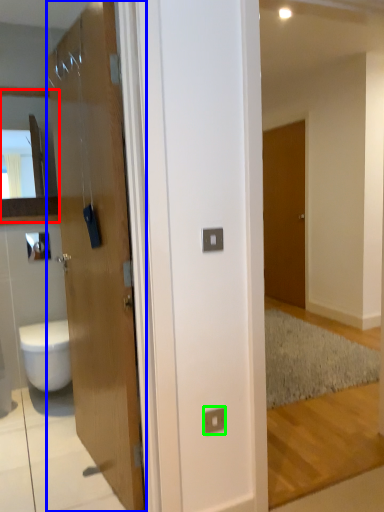
Question: Based on their relative distances, which object is nearer to cabinet (highlighted by a red box)? Choose from door (highlighted by a blue box) and electric outlet (highlighted by a green box).

Choices:
 (A) door
 (B) electric outlet

Answer: (A)